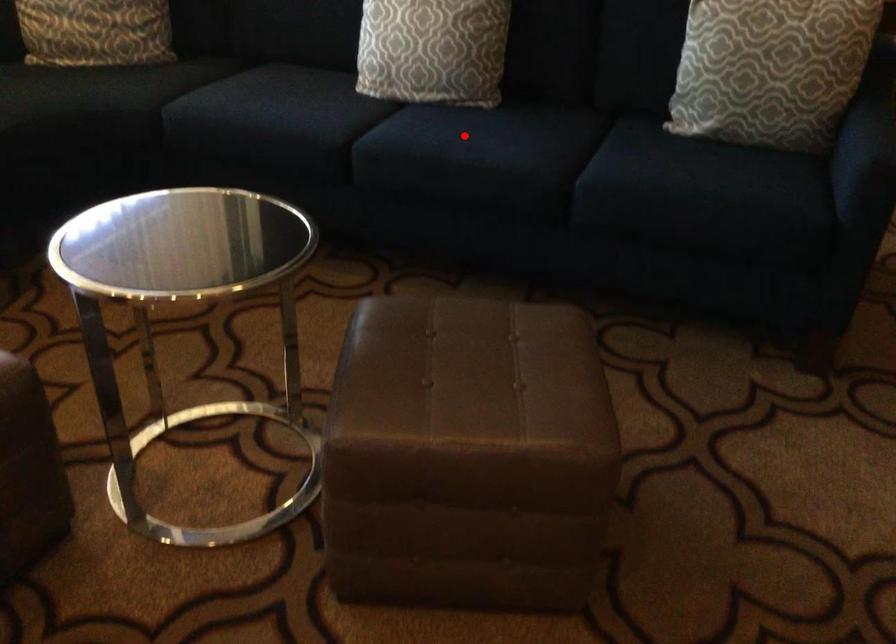
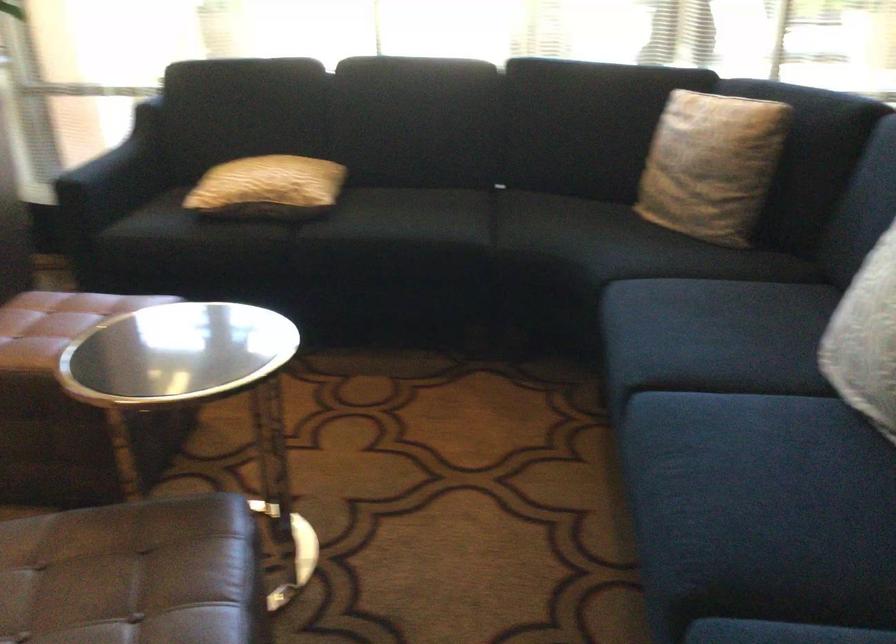
Question: I am providing you with two images of the same scene from different viewpoints. Image1 has a red point marked. In image2, the corresponding 3D location appears at what relative position? Reply with the corresponding letter.

Choices:
 (A) Closer
 (B) Farther

Answer: (A)